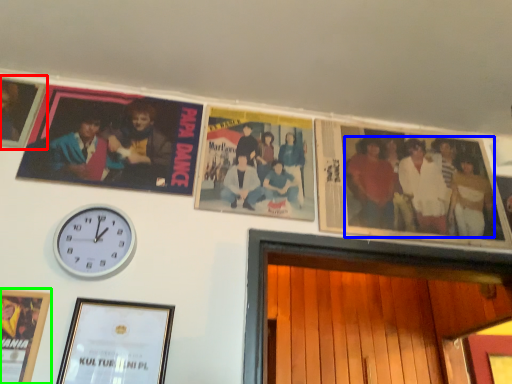
Question: Estimate the real-world distances between objects in this image. Which object is farther from picture frame (highlighted by a red box), person (highlighted by a blue box) or picture frame (highlighted by a green box)?

Choices:
 (A) person
 (B) picture frame

Answer: (A)